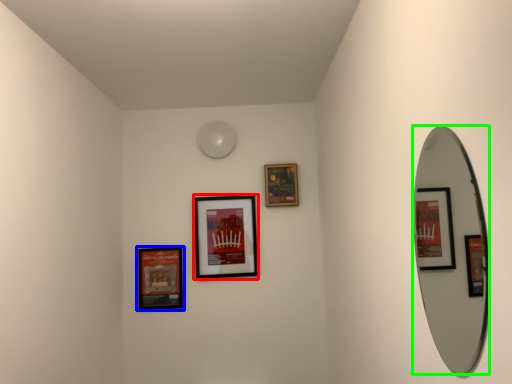
Question: Which object is positioned farthest from picture frame (highlighted by a red box)? Select from picture frame (highlighted by a blue box) and mirror (highlighted by a green box).

Choices:
 (A) picture frame
 (B) mirror

Answer: (B)